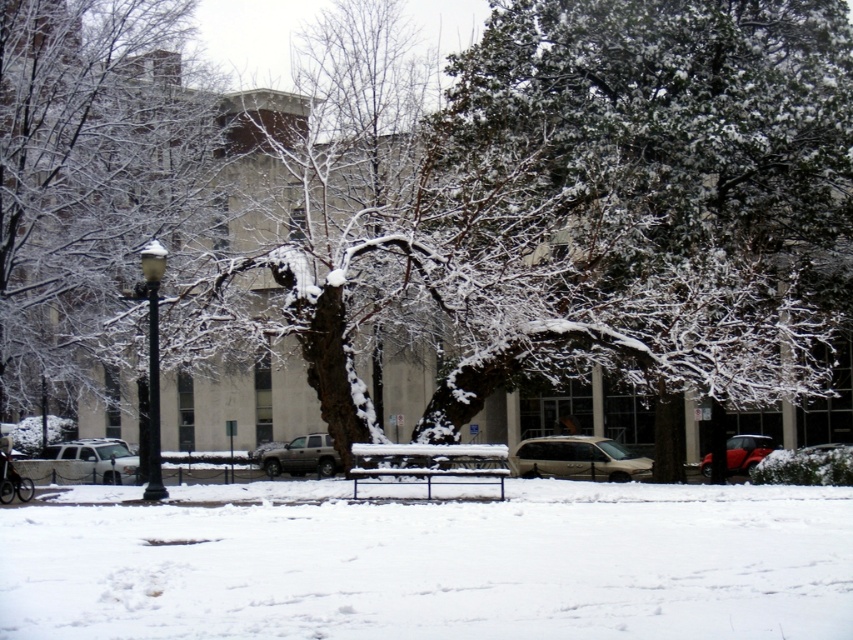
You are standing in the winter scene and want to walk from point A to point B. Point A is at coordinate point(323, 451) and point B is at coordinate point(727, 458). Which point is closer to you when you start walking?

Point A at coordinate point(323, 451) is closer to you because it is further to the camera than point B at coordinate point(727, 458), meaning it is physically nearer in the scene.